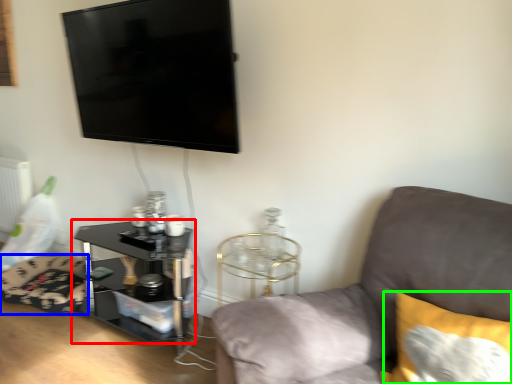
Question: Which object is the farthest from table (highlighted by a red box)? Choose among these: swivel chair (highlighted by a blue box) or pillow (highlighted by a green box).

Choices:
 (A) swivel chair
 (B) pillow

Answer: (B)